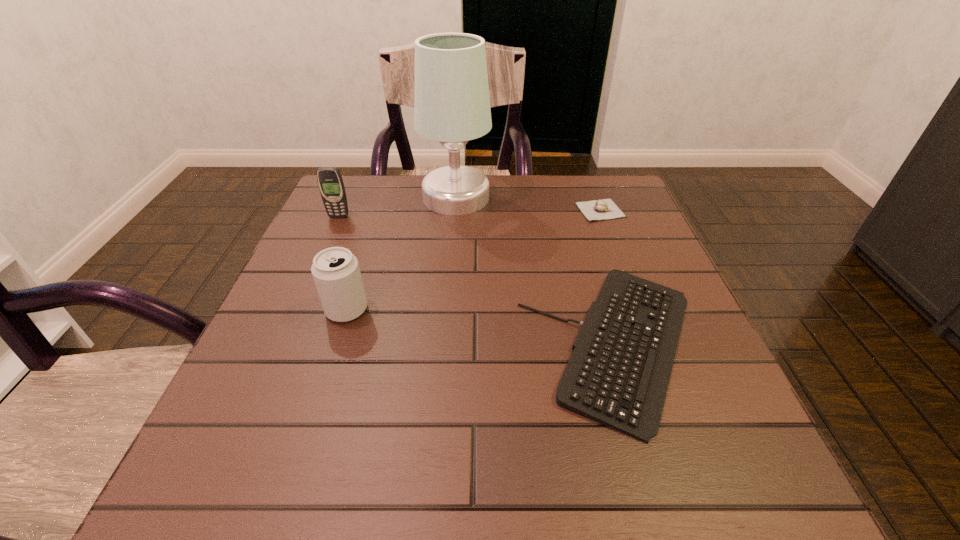
You are a GUI agent. You are given a task and a screenshot of the screen. Output one action in this format:
    pyautogui.click(x=<x>, y=<y>)
    Task: Click on the lampshade
    This screenshot has height=540, width=960.
    Given the screenshot: What is the action you would take?
    pyautogui.click(x=452, y=105)

In order to click on the third object from left to right in this screenshot , I will do `click(452, 105)`.

The height and width of the screenshot is (540, 960). I want to click on cellular telephone, so click(330, 182).

This screenshot has height=540, width=960. I want to click on the second object from left to right, so click(x=336, y=273).

Identify the location of garlic. This screenshot has width=960, height=540. (603, 209).

You are a GUI agent. You are given a task and a screenshot of the screen. Output one action in this format:
    pyautogui.click(x=<x>, y=<y>)
    Task: Click on the shortest object
    This screenshot has width=960, height=540.
    Given the screenshot: What is the action you would take?
    pyautogui.click(x=618, y=374)

Image resolution: width=960 pixels, height=540 pixels. What are the coordinates of `blank area located on the base of the tallest object` in the screenshot? It's located at (551, 197).

Find the location of a particular element. Image resolution: width=960 pixels, height=540 pixels. vacant space located on the screen of the cellular telephone is located at coordinates (330, 238).

In order to click on blank space located 0.150m on the back of the can in this screenshot , I will do `click(366, 250)`.

Where is `free space located 0.150m on the front of the garlic`? This screenshot has width=960, height=540. free space located 0.150m on the front of the garlic is located at coordinates (619, 261).